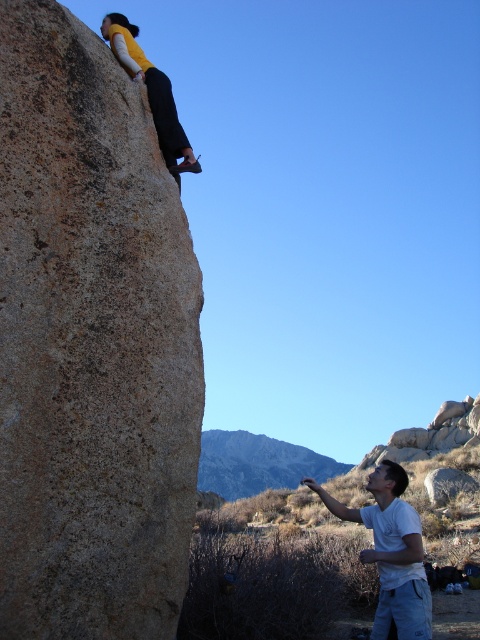
Which is more to the right, matte yellow shirt at upper center or smooth gray rock at lower right?

smooth gray rock at lower right is more to the right.

Find the location of a particular element. matte yellow shirt at upper center is located at coordinates (151, 92).

The height and width of the screenshot is (640, 480). I want to click on matte yellow shirt at upper center, so click(x=151, y=92).

Image resolution: width=480 pixels, height=640 pixels. What do you see at coordinates (91, 344) in the screenshot?
I see `rough textured rock at upper left` at bounding box center [91, 344].

Which of these two, rough textured rock at upper left or matte yellow shirt at upper center, stands taller?

Standing taller between the two is matte yellow shirt at upper center.

Between point (62, 451) and point (170, 150), which one is positioned behind?

Positioned behind is point (170, 150).

What are the coordinates of `rough textured rock at upper left` in the screenshot? It's located at pyautogui.click(x=91, y=344).

Looking at this image, can you confirm if white cotton shirt at lower right is thinner than matte yellow shirt at upper center?

Yes, white cotton shirt at lower right is thinner than matte yellow shirt at upper center.

Between point (403, 548) and point (120, 44), which one is positioned in front?

Point (120, 44)

Is point (392, 560) positioned behind point (123, 17)?

Yes.

Locate an element on the screen. The height and width of the screenshot is (640, 480). white cotton shirt at lower right is located at coordinates (391, 552).